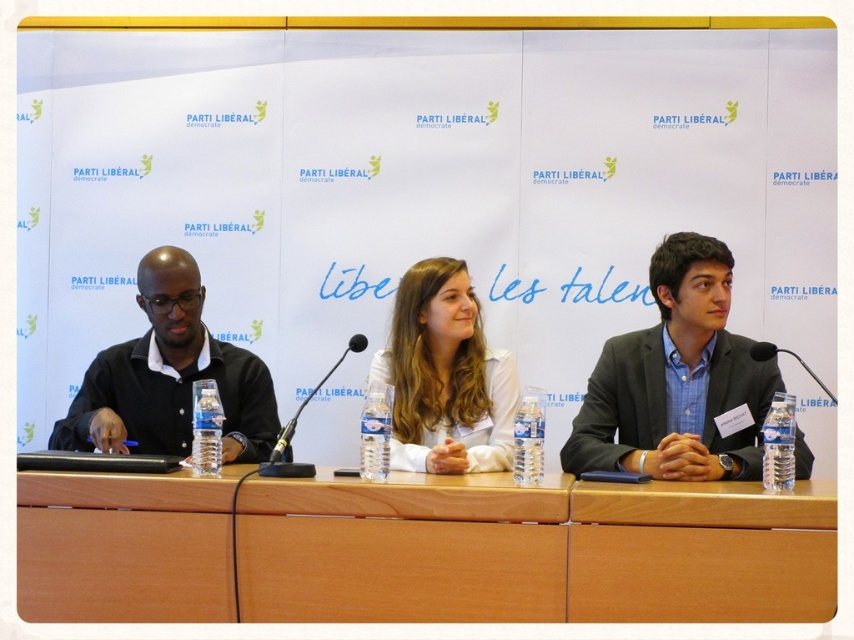
Based on the photo, can you confirm if light brown wood table at center is bigger than matte black suit at right?

No, light brown wood table at center is not bigger than matte black suit at right.

Is point (246, 545) in front of point (667, 472)?

Yes, point (246, 545) is closer to viewer.

Identify the location of light brown wood table at center. (534, 552).

Is white matte shirt at center closer to camera compared to black plastic microphone at center?

No, white matte shirt at center is behind black plastic microphone at center.

Does white matte shirt at center have a lesser height compared to black plastic microphone at center?

Incorrect, white matte shirt at center's height does not fall short of black plastic microphone at center's.

Locate an element on the screen. The image size is (854, 640). white matte shirt at center is located at coordinates (445, 376).

Which is more to the left, light brown wood table at center or black matte shirt at left?

Positioned to the left is black matte shirt at left.

What are the coordinates of `light brown wood table at center` in the screenshot? It's located at [534, 552].